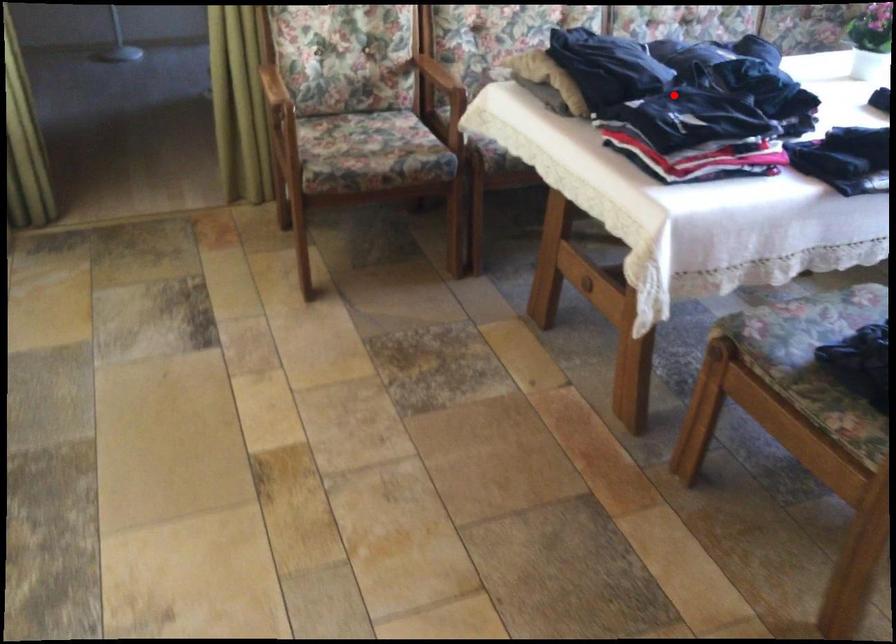
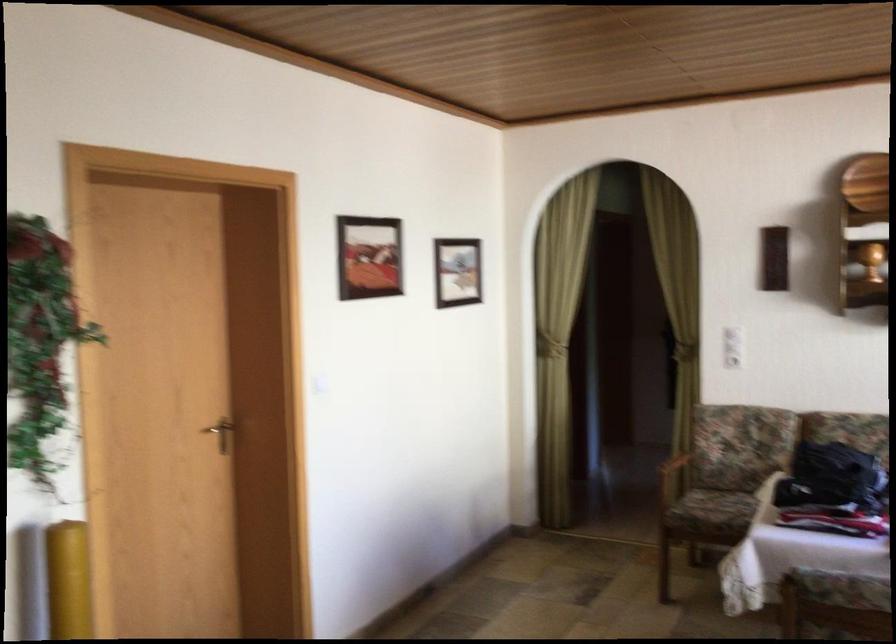
Question: I am providing you with two images of the same scene from different viewpoints. In image1, a red point is highlighted. Considering the same 3D point in image2, which of the following is correct?

Choices:
 (A) It is closer
 (B) It is farther

Answer: (B)